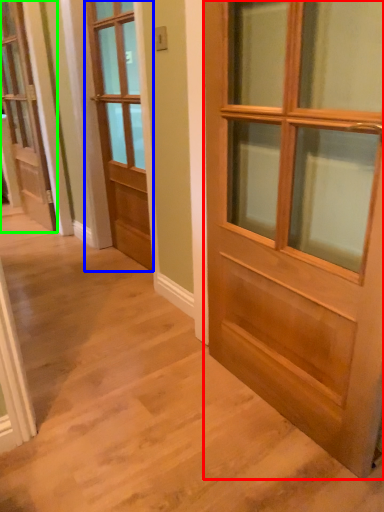
Question: Based on their relative distances, which object is nearer to door (highlighted by a red box)? Choose from door (highlighted by a blue box) and door (highlighted by a green box).

Choices:
 (A) door
 (B) door

Answer: (A)